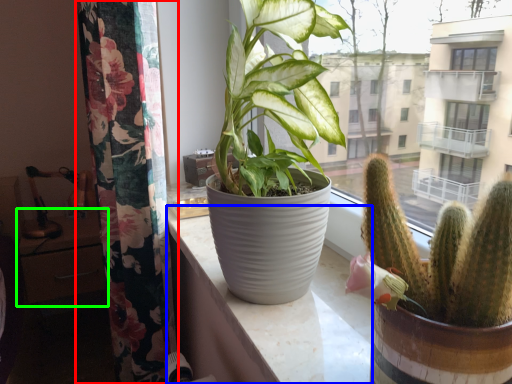
Question: Which object is the farthest from curtain (highlighted by a red box)? Choose among these: counter top (highlighted by a blue box) or table (highlighted by a green box).

Choices:
 (A) counter top
 (B) table

Answer: (B)